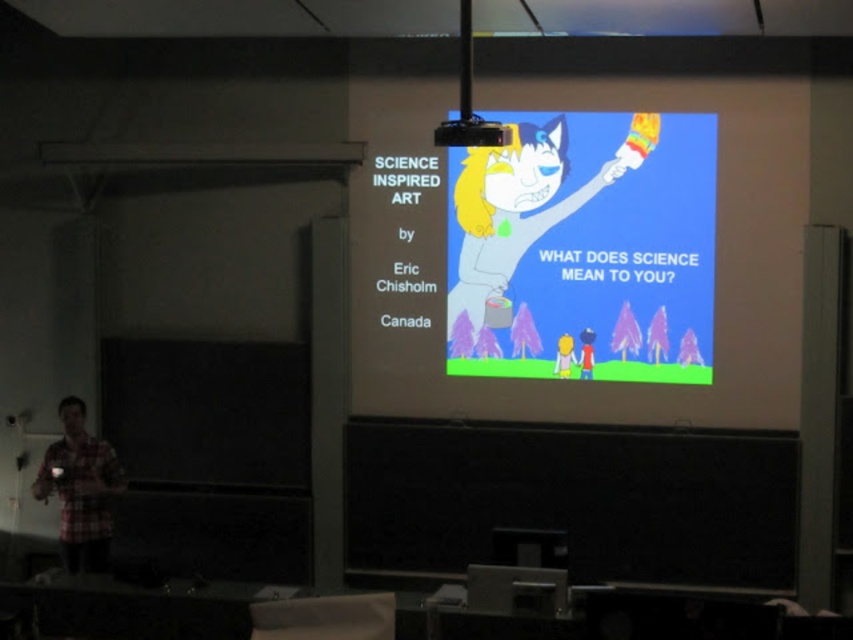
Who is lower down, cartoon character at upper right or plaid flannel shirt at lower left?

plaid flannel shirt at lower left is below.

Find the location of `cartoon character at upper right`. cartoon character at upper right is located at coordinates (584, 248).

This screenshot has height=640, width=853. I want to click on plaid flannel shirt at lower left, so click(x=80, y=488).

Does plaid flannel shirt at lower left have a lesser width compared to black plastic projector at upper center?

In fact, plaid flannel shirt at lower left might be wider than black plastic projector at upper center.

This screenshot has width=853, height=640. In order to click on plaid flannel shirt at lower left in this screenshot , I will do `click(80, 488)`.

Is cartoon character at upper right further to the viewer compared to black plastic projector at upper center?

That is True.

Who is higher up, cartoon character at upper right or black plastic projector at upper center?

black plastic projector at upper center

Who is more distant from viewer, (x=677, y=228) or (x=467, y=147)?

Positioned behind is point (x=677, y=228).

Where is `cartoon character at upper right`? The width and height of the screenshot is (853, 640). cartoon character at upper right is located at coordinates (584, 248).